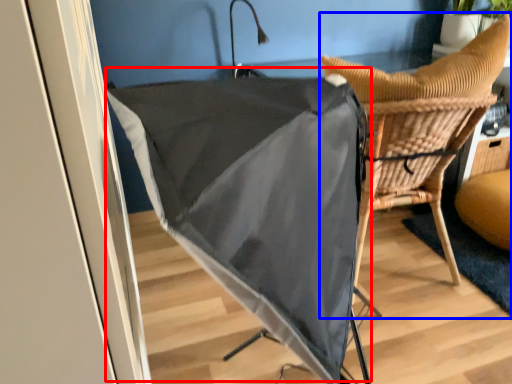
Question: Which object is closer to the camera taking this photo, umbrella (highlighted by a red box) or chair (highlighted by a blue box)?

Choices:
 (A) umbrella
 (B) chair

Answer: (A)